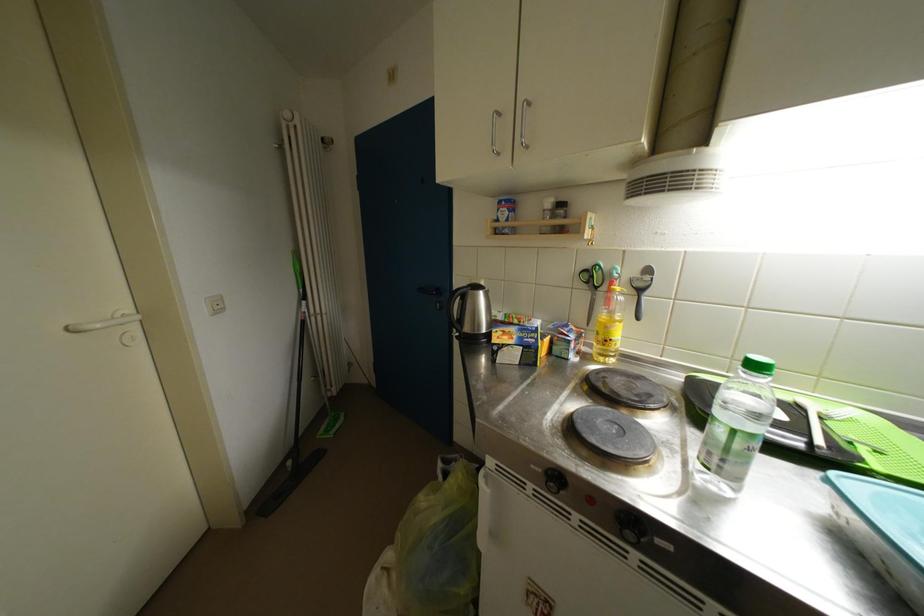
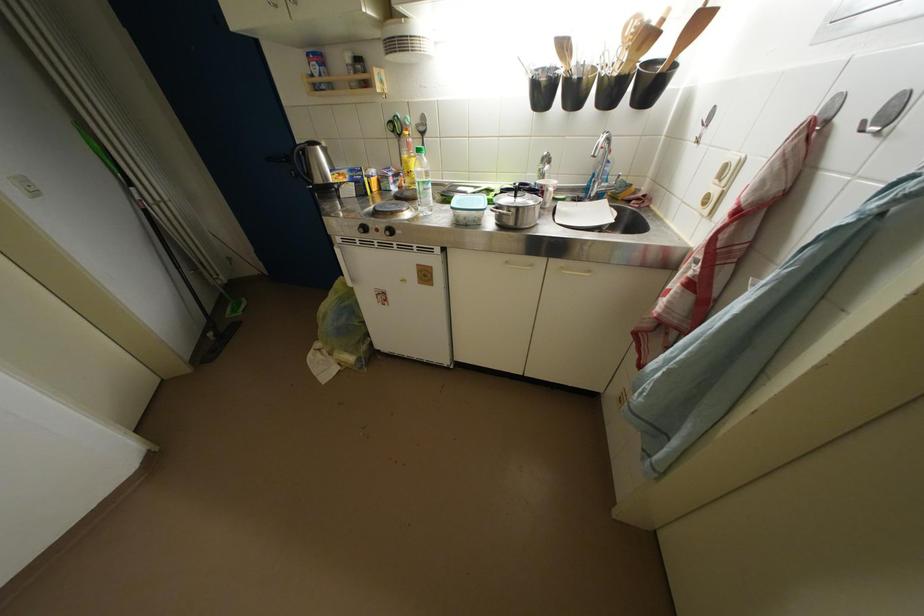
Locate, in the second image, the point that corresponds to point (614, 331) in the first image.

(412, 167)